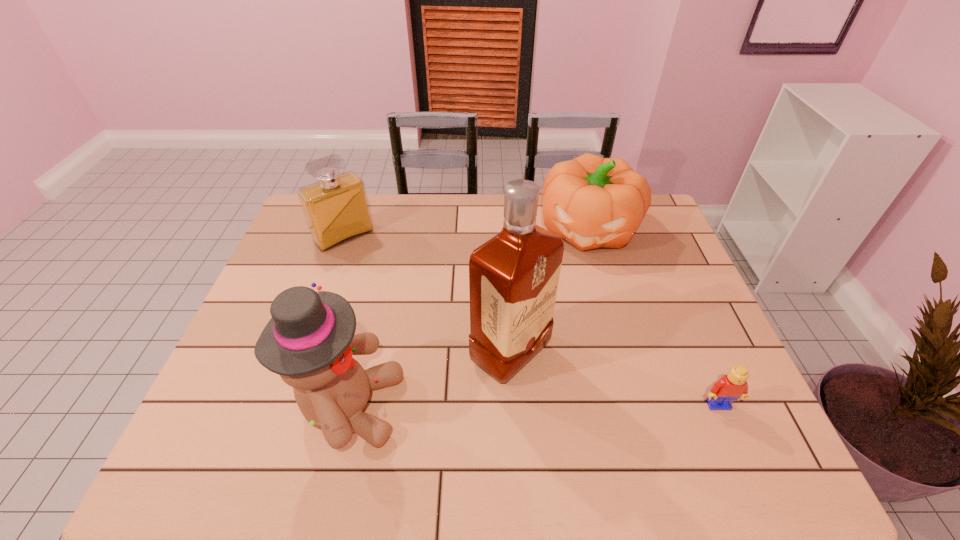
Image resolution: width=960 pixels, height=540 pixels. Identify the location of object present at the left edge. (336, 209).

Where is `Lego that is positioned at the right edge`? Image resolution: width=960 pixels, height=540 pixels. Lego that is positioned at the right edge is located at coordinates (730, 387).

Where is `pumpkin that is at the right edge`? Image resolution: width=960 pixels, height=540 pixels. pumpkin that is at the right edge is located at coordinates (592, 202).

The height and width of the screenshot is (540, 960). Identify the location of object that is at the far left corner. (336, 209).

This screenshot has width=960, height=540. I want to click on object that is at the far right corner, so click(592, 202).

The width and height of the screenshot is (960, 540). What are the coordinates of `object that is at the near right corner` in the screenshot? It's located at (730, 387).

You are a GUI agent. You are given a task and a screenshot of the screen. Output one action in this format:
    pyautogui.click(x=<x>, y=<y>)
    Task: Click on the vacant space at the far edge
    The width and height of the screenshot is (960, 540).
    Given the screenshot: What is the action you would take?
    pyautogui.click(x=420, y=205)

This screenshot has width=960, height=540. In the image, there is a desktop. What are the coordinates of `blank space at the near edge` in the screenshot? It's located at (516, 411).

The image size is (960, 540). Identify the location of free space at the left edge of the desktop. click(x=316, y=260).

In the image, there is a desktop. At what (x,y) coordinates should I click in order to perform the action: click on vacant space at the right edge. Please return your answer as a coordinate pair (x, y). This screenshot has width=960, height=540. Looking at the image, I should click on (670, 292).